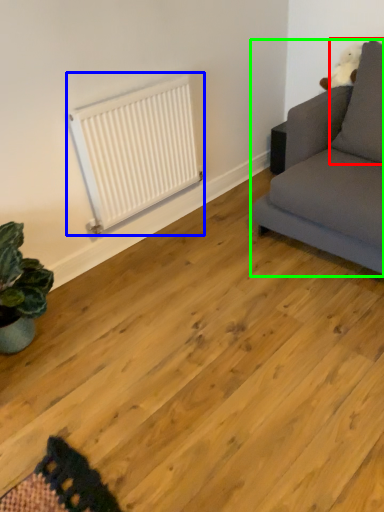
Question: Which is farther away from pillow (highlighted by a red box)? radiator (highlighted by a blue box) or studio couch (highlighted by a green box)?

Choices:
 (A) radiator
 (B) studio couch

Answer: (A)